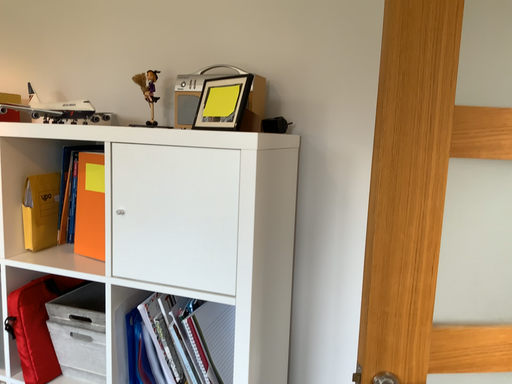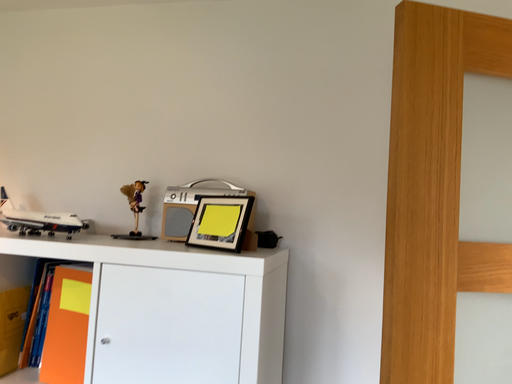
Question: Which way did the camera rotate in the video?

Choices:
 (A) rotated left
 (B) rotated right

Answer: (B)